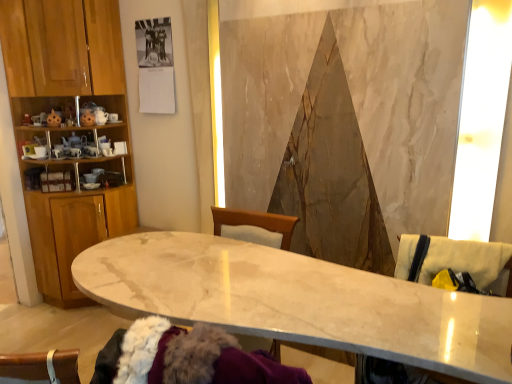
Measure the distance between point (99, 257) and camera.

5.70 feet.

Locate an element on the screen. beige fabric swivel chair at right, the second swivel chair when ordered from bottom to top is located at coordinates (509, 277).

At what (x,y) coordinates should I click in order to perform the action: click on marble table at center. Please return your answer as a coordinate pair (x, y). Image resolution: width=512 pixels, height=384 pixels. Looking at the image, I should click on (298, 301).

Is beige fabric swivel chair at right, which is the 1th swivel chair from bottom to top, smaller than wooden cabinet at left?

Indeed, beige fabric swivel chair at right, which is the 1th swivel chair from bottom to top, has a smaller size compared to wooden cabinet at left.

Is beige fabric swivel chair at right, the second swivel chair in the top-to-bottom sequence, oriented towards wooden cabinet at left?

No, beige fabric swivel chair at right, the second swivel chair in the top-to-bottom sequence, is not aimed at wooden cabinet at left.

Looking at this image, from the image's perspective, is beige fabric swivel chair at right, which is the 1th swivel chair from bottom to top, over wooden cabinet at left?

Incorrect, from the image's perspective, beige fabric swivel chair at right, which is the 1th swivel chair from bottom to top, is lower than wooden cabinet at left.

How distant is beige fabric swivel chair at right, the second swivel chair in the top-to-bottom sequence, from beige fabric swivel chair at right, which ranks as the first swivel chair in top-to-bottom order?

They are 19.16 inches apart.

At what (x,y) coordinates should I click in order to perform the action: click on swivel chair below the beige fabric swivel chair at right, the second swivel chair when ordered from bottom to top (from a real-world perspective). Please return your answer as a coordinate pair (x, y). The image size is (512, 384). Looking at the image, I should click on coord(399,373).

From the image's perspective, is beige fabric swivel chair at right, which is the 1th swivel chair from bottom to top, on top of beige fabric swivel chair at right, which ranks as the first swivel chair in top-to-bottom order?

No, from the image's perspective, beige fabric swivel chair at right, which is the 1th swivel chair from bottom to top, is not on top of beige fabric swivel chair at right, which ranks as the first swivel chair in top-to-bottom order.

Based on the photo, from a real-world perspective, is beige fabric swivel chair at right, the second swivel chair in the top-to-bottom sequence, on beige fabric swivel chair at right, the second swivel chair when ordered from bottom to top?

No, from a real-world perspective, beige fabric swivel chair at right, the second swivel chair in the top-to-bottom sequence, is not over beige fabric swivel chair at right, the second swivel chair when ordered from bottom to top

Is beige fabric swivel chair at right, which ranks as the first swivel chair in top-to-bottom order, with wooden cabinet at left?

No, beige fabric swivel chair at right, which ranks as the first swivel chair in top-to-bottom order, is not touching wooden cabinet at left.

Does beige fabric swivel chair at right, which ranks as the first swivel chair in top-to-bottom order, lie behind wooden cabinet at left?

No.

Between beige fabric swivel chair at right, which ranks as the first swivel chair in top-to-bottom order, and wooden cabinet at left, which one appears on the right side from the viewer's perspective?

beige fabric swivel chair at right, which ranks as the first swivel chair in top-to-bottom order, is more to the right.

Looking at this image, is beige fabric swivel chair at right, which ranks as the first swivel chair in top-to-bottom order, wider than wooden cabinet at left?

In fact, beige fabric swivel chair at right, which ranks as the first swivel chair in top-to-bottom order, might be narrower than wooden cabinet at left.

Choose the correct answer: Is wooden cabinet at left inside marble table at center or outside it?

wooden cabinet at left is not inside marble table at center, it's outside.

Can you confirm if wooden cabinet at left is smaller than marble table at center?

Correct, wooden cabinet at left occupies less space than marble table at center.

Which object is more forward, wooden cabinet at left or marble table at center?

marble table at center is closer to the camera.

Consider the image. How distant is wooden cabinet at left from marble table at center?

wooden cabinet at left and marble table at center are 5.12 feet apart from each other.

Is beige fabric swivel chair at right, which ranks as the first swivel chair in top-to-bottom order, completely or partially inside wooden cabinet at left?

Definitely not — beige fabric swivel chair at right, which ranks as the first swivel chair in top-to-bottom order, is not inside wooden cabinet at left.

Consider the image. From a real-world perspective, is wooden cabinet at left located higher than beige fabric swivel chair at right, the second swivel chair when ordered from bottom to top?

Correct, in the physical world, wooden cabinet at left is higher than beige fabric swivel chair at right, the second swivel chair when ordered from bottom to top.

Based on the photo, is wooden cabinet at left positioned with its back to beige fabric swivel chair at right, the second swivel chair when ordered from bottom to top?

No.

Is wooden cabinet at left further to the viewer compared to beige fabric swivel chair at right, the second swivel chair when ordered from bottom to top?

Yes, it is behind beige fabric swivel chair at right, the second swivel chair when ordered from bottom to top.

This screenshot has height=384, width=512. Find the location of `countertop that appears below the beige fabric swivel chair at right, the second swivel chair in the top-to-bottom sequence (from a real-world perspective)`. countertop that appears below the beige fabric swivel chair at right, the second swivel chair in the top-to-bottom sequence (from a real-world perspective) is located at coordinates (298, 301).

Is marble table at center next to beige fabric swivel chair at right, which is the 1th swivel chair from bottom to top, and touching it?

marble table at center is not next to beige fabric swivel chair at right, which is the 1th swivel chair from bottom to top, and they're not touching.

Is beige fabric swivel chair at right, which is the 1th swivel chair from bottom to top, completely or partially inside marble table at center?

Yes, beige fabric swivel chair at right, which is the 1th swivel chair from bottom to top, is a part of marble table at center.

From a real-world perspective, between marble table at center and beige fabric swivel chair at right, the second swivel chair in the top-to-bottom sequence, who is vertically higher?

From a 3D spatial view, beige fabric swivel chair at right, the second swivel chair in the top-to-bottom sequence, is above.

Considering the positions of objects wooden cabinet at left and beige fabric swivel chair at right, which is the 1th swivel chair from bottom to top, in the image provided, who is in front, wooden cabinet at left or beige fabric swivel chair at right, which is the 1th swivel chair from bottom to top,?

beige fabric swivel chair at right, which is the 1th swivel chair from bottom to top.

At what (x,y) coordinates should I click in order to perform the action: click on the 1st swivel chair counting from the right of the wooden cabinet at left. Please return your answer as a coordinate pair (x, y). This screenshot has width=512, height=384. Looking at the image, I should click on (399, 373).

Does wooden cabinet at left have a smaller size compared to beige fabric swivel chair at right, which is the 1th swivel chair from bottom to top?

No.

In order to click on swivel chair that is the 1st object to the right of the wooden cabinet at left, starting at the anchor in this screenshot , I will do `click(399, 373)`.

This screenshot has height=384, width=512. I want to click on swivel chair behind the beige fabric swivel chair at right, the second swivel chair in the top-to-bottom sequence, so click(x=509, y=277).

Looking at the image, which one is located closer to marble table at center, beige fabric swivel chair at right, the second swivel chair in the top-to-bottom sequence, or beige fabric swivel chair at right, the second swivel chair when ordered from bottom to top?

The object closer to marble table at center is beige fabric swivel chair at right, the second swivel chair in the top-to-bottom sequence.

When comparing their distances from beige fabric swivel chair at right, which is the 1th swivel chair from bottom to top, does marble table at center or beige fabric swivel chair at right, which ranks as the first swivel chair in top-to-bottom order, seem closer?

Among the two, marble table at center is located nearer to beige fabric swivel chair at right, which is the 1th swivel chair from bottom to top.

From the image, which object appears to be nearer to beige fabric swivel chair at right, which ranks as the first swivel chair in top-to-bottom order, beige fabric swivel chair at right, which is the 1th swivel chair from bottom to top, or wooden cabinet at left?

Based on the image, beige fabric swivel chair at right, which is the 1th swivel chair from bottom to top, appears to be nearer to beige fabric swivel chair at right, which ranks as the first swivel chair in top-to-bottom order.

Based on their spatial positions, is marble table at center or beige fabric swivel chair at right, the second swivel chair when ordered from bottom to top, closer to wooden cabinet at left?

The object closer to wooden cabinet at left is marble table at center.

Estimate the real-world distances between objects in this image. Which object is further from marble table at center, beige fabric swivel chair at right, the second swivel chair when ordered from bottom to top, or wooden cabinet at left?

wooden cabinet at left.

From the image, which object appears to be farther from marble table at center, beige fabric swivel chair at right, the second swivel chair in the top-to-bottom sequence, or wooden cabinet at left?

wooden cabinet at left lies further to marble table at center than the other object.

Based on the photo, from the image, which object appears to be nearer to wooden cabinet at left, beige fabric swivel chair at right, the second swivel chair when ordered from bottom to top, or beige fabric swivel chair at right, which is the 1th swivel chair from bottom to top?

beige fabric swivel chair at right, which is the 1th swivel chair from bottom to top, is closer to wooden cabinet at left.

Estimate the real-world distances between objects in this image. Which object is closer to beige fabric swivel chair at right, the second swivel chair in the top-to-bottom sequence, wooden cabinet at left or beige fabric swivel chair at right, which ranks as the first swivel chair in top-to-bottom order?

Based on the image, beige fabric swivel chair at right, which ranks as the first swivel chair in top-to-bottom order, appears to be nearer to beige fabric swivel chair at right, the second swivel chair in the top-to-bottom sequence.

Locate an element on the screen. swivel chair situated between wooden cabinet at left and beige fabric swivel chair at right, the second swivel chair when ordered from bottom to top, from left to right is located at coordinates (399, 373).

Identify the location of countertop between wooden cabinet at left and beige fabric swivel chair at right, which is the 1th swivel chair from bottom to top, from left to right. The width and height of the screenshot is (512, 384). (298, 301).

Locate an element on the screen. The width and height of the screenshot is (512, 384). swivel chair located between marble table at center and beige fabric swivel chair at right, which ranks as the first swivel chair in top-to-bottom order, in the left-right direction is located at coordinates (399, 373).

I want to click on countertop located between wooden cabinet at left and beige fabric swivel chair at right, the second swivel chair when ordered from bottom to top, in the left-right direction, so click(298, 301).